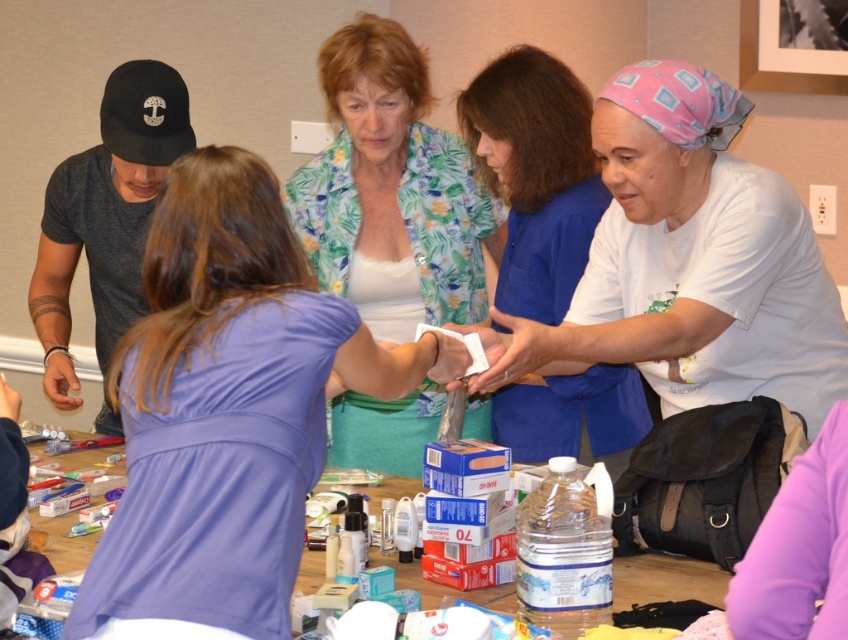
Consider the image. Does floral fabric blouse at center have a lesser height compared to dark gray cotton t-shirt at left?

In fact, floral fabric blouse at center may be taller than dark gray cotton t-shirt at left.

Does floral fabric blouse at center have a smaller size compared to dark gray cotton t-shirt at left?

Yes.

Is point (385, 305) in front of point (127, 224)?

That is True.

In order to click on floral fabric blouse at center in this screenshot , I will do `click(391, 189)`.

Is white matte shirt at center bigger than floral fabric blouse at center?

Actually, white matte shirt at center might be smaller than floral fabric blouse at center.

Can you confirm if white matte shirt at center is positioned to the right of floral fabric blouse at center?

Yes, white matte shirt at center is to the right of floral fabric blouse at center.

Does point (671, 120) lie behind point (353, 40)?

No.

This screenshot has height=640, width=848. Find the location of `white matte shirt at center`. white matte shirt at center is located at coordinates (701, 257).

Who is shorter, floral fabric blouse at center or pink fabric headscarf at upper right?

Standing shorter between the two is pink fabric headscarf at upper right.

Who is lower down, floral fabric blouse at center or pink fabric headscarf at upper right?

Positioned lower is pink fabric headscarf at upper right.

Is point (333, 291) positioned behind point (499, 97)?

Yes, it is behind point (499, 97).

Find the location of a particular element. Image resolution: width=848 pixels, height=640 pixels. floral fabric blouse at center is located at coordinates (391, 189).